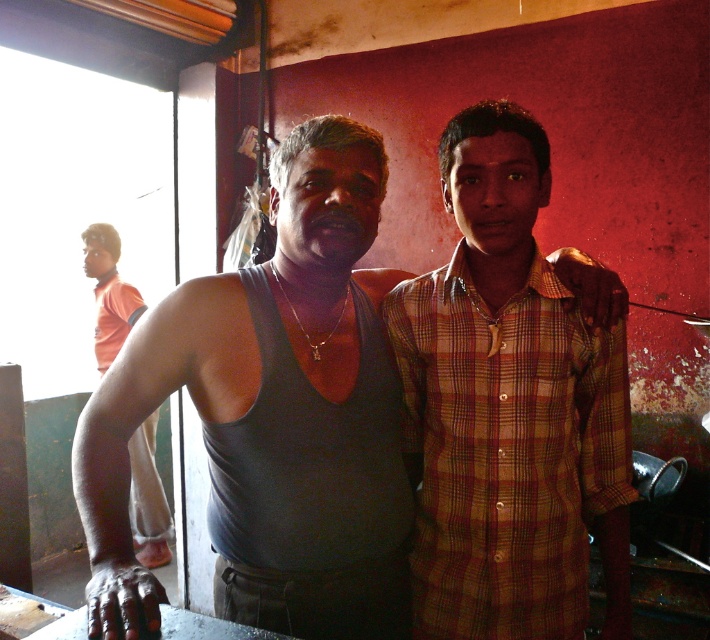
Question: From the image, what is the correct spatial relationship of gray matte tank top at center in relation to orange fabric shirt at left?

Choices:
 (A) above
 (B) below

Answer: (A)

Question: Where is plaid shirt at center located in relation to orange fabric shirt at left in the image?

Choices:
 (A) left
 (B) right

Answer: (B)

Question: Estimate the real-world distances between objects in this image. Which object is closer to the orange fabric shirt at left?

Choices:
 (A) dark gray tank top at center
 (B) gray matte tank top at center
 (C) plaid shirt at center

Answer: (B)

Question: Considering the real-world distances, which object is closest to the plaid shirt at center?

Choices:
 (A) gray matte tank top at center
 (B) orange fabric shirt at left

Answer: (A)

Question: Which object appears closest to the camera in this image?

Choices:
 (A) dark gray tank top at center
 (B) gray matte tank top at center
 (C) orange fabric shirt at left

Answer: (A)

Question: Does dark gray tank top at center have a smaller size compared to gray matte tank top at center?

Choices:
 (A) no
 (B) yes

Answer: (A)